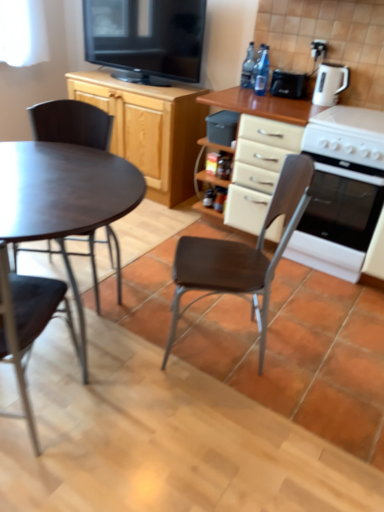
What do you see at coordinates (248, 67) in the screenshot?
I see `transparent plastic bottles at upper center, arranged as the 2th bottle when viewed from the front` at bounding box center [248, 67].

Image resolution: width=384 pixels, height=512 pixels. I want to click on matte wood cabinet at center, so click(262, 105).

Is transparent plastic bottle at upper center, marked as the first bottle in a front-to-back arrangement, not close to black plastic container at center, marked as the first appliance in a left-to-right arrangement?

transparent plastic bottle at upper center, marked as the first bottle in a front-to-back arrangement, is near black plastic container at center, marked as the first appliance in a left-to-right arrangement, not far away.

Can you tell me how much transparent plastic bottle at upper center, marked as the first bottle in a front-to-back arrangement, and black plastic container at center, placed as the 1th appliance when sorted from bottom to top, differ in facing direction?

The angle between the facing direction of transparent plastic bottle at upper center, marked as the first bottle in a front-to-back arrangement, and the facing direction of black plastic container at center, placed as the 1th appliance when sorted from bottom to top, is 2 degrees.

Is transparent plastic bottle at upper center, marked as the first bottle in a front-to-back arrangement, situated inside black plastic container at center, marked as the first appliance in a left-to-right arrangement, or outside?

transparent plastic bottle at upper center, marked as the first bottle in a front-to-back arrangement, is spatially situated outside black plastic container at center, marked as the first appliance in a left-to-right arrangement.

From a real-world perspective, between transparent plastic bottle at upper center, marked as the first bottle in a front-to-back arrangement, and black plastic container at center, placed as the second appliance when sorted from top to bottom, who is vertically lower?

black plastic container at center, placed as the second appliance when sorted from top to bottom, is physically lower.

The image size is (384, 512). In order to click on bottle above the transparent plastic bottle at upper center, the second bottle viewed from the back (from the image's perspective) in this screenshot , I will do `click(248, 67)`.

Which of these two, transparent plastic bottles at upper center, which appears as the 1th bottle when viewed from the back, or transparent plastic bottle at upper center, the second bottle viewed from the back, is smaller?

With smaller size is transparent plastic bottle at upper center, the second bottle viewed from the back.

From the picture: Is transparent plastic bottles at upper center, arranged as the 2th bottle when viewed from the front, in contact with transparent plastic bottle at upper center, the second bottle viewed from the back?

Yes, transparent plastic bottles at upper center, arranged as the 2th bottle when viewed from the front, is touching transparent plastic bottle at upper center, the second bottle viewed from the back.

From a real-world perspective, between matte dark brown table at left and metallic dark brown chair at left, the first chair from the left, who is vertically higher?

metallic dark brown chair at left, the first chair from the left.

In the scene shown: Can you confirm if matte dark brown table at left is smaller than metallic dark brown chair at left, the first chair from the left?

No.

Would you say matte dark brown table at left contains metallic dark brown chair at left, the first chair from the left?

Indeed, metallic dark brown chair at left, the first chair from the left, is located within matte dark brown table at left.

From a real-world perspective, is black plastic container at center, the second appliance when ordered from right to left, physically above matte wood cabinet at center?

Yes, from a real-world perspective, black plastic container at center, the second appliance when ordered from right to left, is over matte wood cabinet at center

Is black plastic container at center, placed as the second appliance when sorted from top to bottom, facing away from matte wood cabinet at center?

Yes, matte wood cabinet at center is at the back of black plastic container at center, placed as the second appliance when sorted from top to bottom.

Is black plastic container at center, marked as the first appliance in a left-to-right arrangement, beside matte wood cabinet at center?

black plastic container at center, marked as the first appliance in a left-to-right arrangement, and matte wood cabinet at center are clearly separated.

Is white glossy oven at right oriented away from matte black chair at left, marked as the second chair in a right-to-left arrangement?

That's not correct — white glossy oven at right is not looking away from matte black chair at left, marked as the second chair in a right-to-left arrangement.

Considering the sizes of objects white glossy oven at right and matte black chair at left, marked as the second chair in a right-to-left arrangement, in the image provided, who is thinner, white glossy oven at right or matte black chair at left, marked as the second chair in a right-to-left arrangement,?

matte black chair at left, marked as the second chair in a right-to-left arrangement.

Would you say white glossy oven at right is outside matte black chair at left, which appears as the second chair when viewed from the left?

Yes, white glossy oven at right is outside of matte black chair at left, which appears as the second chair when viewed from the left.

Could you measure the distance between white glossy oven at right and matte black chair at left, which appears as the second chair when viewed from the left?

4.28 feet.

Based on the photo, how many degrees apart are the facing directions of black plastic toaster at upper right, which appears as the 1th appliance when viewed from the right, and white glossy electric kettle at upper right?

There is a 3.06-degree angle between the facing directions of black plastic toaster at upper right, which appears as the 1th appliance when viewed from the right, and white glossy electric kettle at upper right.

Between black plastic toaster at upper right, which appears as the 1th appliance when viewed from the right, and white glossy electric kettle at upper right, which one has smaller width?

white glossy electric kettle at upper right is thinner.

Does black plastic toaster at upper right, which appears as the 1th appliance when viewed from the right, appear on the right side of white glossy electric kettle at upper right?

Incorrect, black plastic toaster at upper right, which appears as the 1th appliance when viewed from the right, is not on the right side of white glossy electric kettle at upper right.

How distant is black plastic toaster at upper right, which appears as the 1th appliance when viewed from the right, from white glossy electric kettle at upper right?

A distance of 7.90 inches exists between black plastic toaster at upper right, which appears as the 1th appliance when viewed from the right, and white glossy electric kettle at upper right.

Is white glossy electric kettle at upper right not near black plastic toaster at upper right, which appears as the 1th appliance when viewed from the right?

No, white glossy electric kettle at upper right is in close proximity to black plastic toaster at upper right, which appears as the 1th appliance when viewed from the right.

What's the angular difference between white glossy electric kettle at upper right and black plastic toaster at upper right, marked as the 2th appliance in a bottom-to-top arrangement,'s facing directions?

They differ by 3.06 degrees in their facing directions.

From the image's perspective, is white glossy electric kettle at upper right located beneath black plastic toaster at upper right, which appears as the 1th appliance when viewed from the right?

Correct, white glossy electric kettle at upper right appears lower than black plastic toaster at upper right, which appears as the 1th appliance when viewed from the right, in the image.

From a real-world perspective, which is physically below, white glossy electric kettle at upper right or black plastic toaster at upper right, which appears as the 1th appliance when viewed from the right?

black plastic toaster at upper right, which appears as the 1th appliance when viewed from the right.

Locate an element on the screen. the 2nd appliance below the transparent plastic bottle at upper center, the second bottle viewed from the back (from the image's perspective) is located at coordinates (222, 127).

At what (x,y) coordinates should I click in order to perform the action: click on bottle that is behind the transparent plastic bottle at upper center, marked as the first bottle in a front-to-back arrangement. Please return your answer as a coordinate pair (x, y). This screenshot has height=512, width=384. Looking at the image, I should click on (248, 67).

When comparing their distances from brown leather chair at center, the third chair viewed from the left, does metallic dark brown chair at left, the first chair from the left, or transparent plastic bottle at upper center, the second bottle viewed from the back, seem closer?

metallic dark brown chair at left, the first chair from the left, is positioned closer to the anchor brown leather chair at center, the third chair viewed from the left.

When comparing their distances from transparent plastic bottle at upper center, the second bottle viewed from the back, does brown leather chair at center, which appears as the 1th chair when viewed from the right, or metallic dark brown chair at left, the first chair from the left, seem further?

metallic dark brown chair at left, the first chair from the left.

Estimate the real-world distances between objects in this image. Which object is further from black plastic toaster at upper right, which appears as the 1th appliance when viewed from the right, white glossy oven at right or transparent plastic bottles at upper center, which appears as the 1th bottle when viewed from the back?

white glossy oven at right is positioned further to the anchor black plastic toaster at upper right, which appears as the 1th appliance when viewed from the right.

When comparing their distances from metallic dark brown chair at left, the first chair from the left, does black glossy television at upper center or white glossy oven at right seem further?

black glossy television at upper center.

Estimate the real-world distances between objects in this image. Which object is closer to black plastic toaster at upper right, marked as the 2th appliance in a bottom-to-top arrangement, metallic dark brown chair at left, the third chair from the right, or white glossy electric kettle at upper right?

white glossy electric kettle at upper right lies closer to black plastic toaster at upper right, marked as the 2th appliance in a bottom-to-top arrangement, than the other object.

Estimate the real-world distances between objects in this image. Which object is further from matte black chair at left, marked as the second chair in a right-to-left arrangement, transparent plastic bottle at upper center, the second bottle viewed from the back, or matte dark brown table at left?

transparent plastic bottle at upper center, the second bottle viewed from the back, is positioned further to the anchor matte black chair at left, marked as the second chair in a right-to-left arrangement.

Estimate the real-world distances between objects in this image. Which object is closer to matte dark brown table at left, brown leather chair at center, which appears as the 1th chair when viewed from the right, or black plastic toaster at upper right, marked as the 2th appliance in a bottom-to-top arrangement?

Based on the image, brown leather chair at center, which appears as the 1th chair when viewed from the right, appears to be nearer to matte dark brown table at left.

Based on their spatial positions, is white glossy electric kettle at upper right or transparent plastic bottles at upper center, arranged as the 2th bottle when viewed from the front, further from matte dark brown table at left?

transparent plastic bottles at upper center, arranged as the 2th bottle when viewed from the front.

You are a GUI agent. You are given a task and a screenshot of the screen. Output one action in this format:
    pyautogui.click(x=<x>, y=<y>)
    Task: Click on the bottle between transparent plastic bottles at upper center, arranged as the 2th bottle when viewed from the front, and black plastic toaster at upper right, which is counted as the second appliance, starting from the left
    The width and height of the screenshot is (384, 512).
    Given the screenshot: What is the action you would take?
    point(262,73)

Find the location of a particular element. This screenshot has height=512, width=384. coffee table positioned between metallic dark brown chair at left, the third chair from the right, and matte wood cabinet at center from near to far is located at coordinates (63, 198).

What are the coordinates of `cabinetry situated between matte dark brown table at left and white glossy oven at right from left to right` in the screenshot? It's located at click(x=149, y=129).

At what (x,y) coordinates should I click in order to perform the action: click on kitchen appliance between transparent plastic bottle at upper center, the second bottle viewed from the back, and white glossy oven at right from top to bottom. Please return your answer as a coordinate pair (x, y). Looking at the image, I should click on (330, 83).